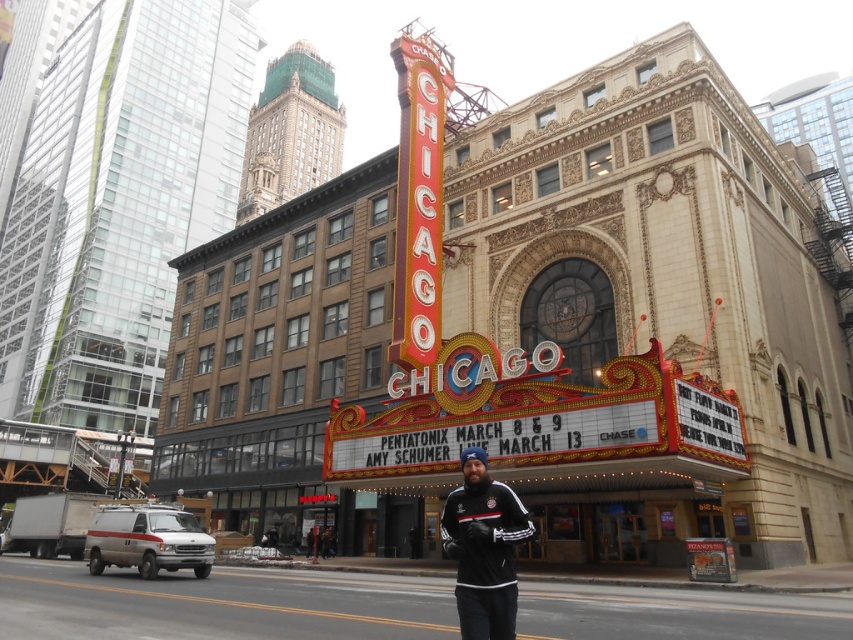
You are a photographer standing at the edge of the Chicago Theatre plaza. You want to take a photo of the marble theater at center and the black fleece jacket at center in the same frame. Which object should you focus on first to ensure both are in the frame?

The marble theater at center is wider than the black fleece jacket at center, so you should focus on the marble theater at center first to ensure both are in the frame.

You are standing at the corner of W Randolph St and N State St in Chicago. You want to go to the marble theater at center. Which direction should you walk to reach it?

Walk towards the direction of the marble theater at center located at point (x=662, y=292).

You are standing in the middle of the street looking at the Chicago Theatre. You see a marble theater at center and a black fleece jacket at center. Which object is closer to you?

The black fleece jacket at center is closer because the marble theater at center is positioned over it, indicating the jacket is in front.